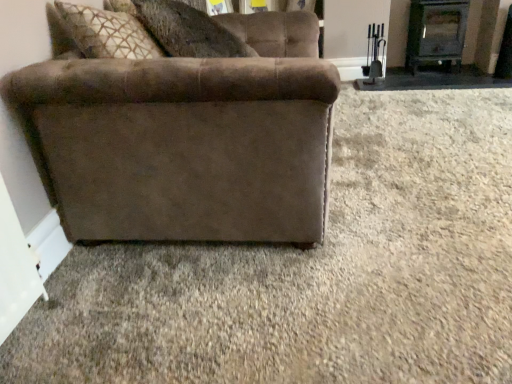
Measure the distance between point (143, 102) and camera.

Point (143, 102) and camera are 1.33 meters apart.

What do you see at coordinates (186, 139) in the screenshot? I see `suede brown couch at left` at bounding box center [186, 139].

You are a GUI agent. You are given a task and a screenshot of the screen. Output one action in this format:
    pyautogui.click(x=<x>, y=<y>)
    Task: Click on the suede-like brown pillow at upper center
    
    Given the screenshot: What is the action you would take?
    pyautogui.click(x=188, y=31)

Considering the relative sizes of black metal fireplace at upper right and suede-like brown pillow at upper center in the image provided, is black metal fireplace at upper right smaller than suede-like brown pillow at upper center?

Indeed, black metal fireplace at upper right has a smaller size compared to suede-like brown pillow at upper center.

From a real-world perspective, is black metal fireplace at upper right on top of suede-like brown pillow at upper center?

No, from a real-world perspective, black metal fireplace at upper right is not above suede-like brown pillow at upper center.

The image size is (512, 384). In the image, there is a suede-like brown pillow at upper center. Find the location of `fireplace below it (from a real-world perspective)`. fireplace below it (from a real-world perspective) is located at coordinates (436, 33).

Looking at their sizes, would you say black metal fireplace at upper right is wider or thinner than suede-like brown pillow at upper center?

In the image, black metal fireplace at upper right appears to be more narrow than suede-like brown pillow at upper center.

Is black metal fireplace at upper right smaller than suede brown couch at left?

Indeed, black metal fireplace at upper right has a smaller size compared to suede brown couch at left.

From the image's perspective, does black metal fireplace at upper right appear higher than suede brown couch at left?

Correct, black metal fireplace at upper right appears higher than suede brown couch at left in the image.

Which of these two, black metal fireplace at upper right or suede brown couch at left, stands shorter?

Standing shorter between the two is black metal fireplace at upper right.

Considering the relative positions of black metal fireplace at upper right and suede brown couch at left in the image provided, is black metal fireplace at upper right behind suede brown couch at left?

Yes.

Which of these two, suede-like brown pillow at upper center or black metal fireplace at upper right, stands taller?

With more height is black metal fireplace at upper right.

How many degrees apart are the facing directions of suede-like brown pillow at upper center and black metal fireplace at upper right?

The facing directions of suede-like brown pillow at upper center and black metal fireplace at upper right are 99.3 degrees apart.

Who is bigger, suede-like brown pillow at upper center or black metal fireplace at upper right?

suede-like brown pillow at upper center is bigger.

Considering the relative sizes of suede-like brown pillow at upper center and black metal fireplace at upper right in the image provided, is suede-like brown pillow at upper center wider than black metal fireplace at upper right?

Indeed, suede-like brown pillow at upper center has a greater width compared to black metal fireplace at upper right.

From a real-world perspective, between suede brown couch at left and black metal fireplace at upper right, who is vertically lower?

black metal fireplace at upper right.

Looking at their sizes, would you say suede brown couch at left is wider or thinner than black metal fireplace at upper right?

Clearly, suede brown couch at left has more width compared to black metal fireplace at upper right.

From the image's perspective, is suede brown couch at left under black metal fireplace at upper right?

Correct, suede brown couch at left appears lower than black metal fireplace at upper right in the image.

Which is correct: suede brown couch at left is inside black metal fireplace at upper right, or outside of it?

suede brown couch at left exists outside the volume of black metal fireplace at upper right.

Based on the photo, is suede-like brown pillow at upper center wider than suede brown couch at left?

In fact, suede-like brown pillow at upper center might be narrower than suede brown couch at left.

Is suede-like brown pillow at upper center behind suede brown couch at left?

Yes, suede-like brown pillow at upper center is further from the viewer.

Considering the relative sizes of suede-like brown pillow at upper center and suede brown couch at left in the image provided, is suede-like brown pillow at upper center taller than suede brown couch at left?

Incorrect, the height of suede-like brown pillow at upper center is not larger of that of suede brown couch at left.

Is there a large distance between suede-like brown pillow at upper center and suede brown couch at left?

Actually, suede-like brown pillow at upper center and suede brown couch at left are a little close together.

From a real-world perspective, is suede brown couch at left positioned above or below suede-like brown pillow at upper center?

Clearly, from a real-world perspective, suede brown couch at left is below suede-like brown pillow at upper center.

From the image's perspective, which is above, suede brown couch at left or suede-like brown pillow at upper center?

suede-like brown pillow at upper center, from the image's perspective.

Identify the location of studio couch below the suede-like brown pillow at upper center (from the image's perspective). The height and width of the screenshot is (384, 512). (186, 139).

Who is smaller, suede brown couch at left or suede-like brown pillow at upper center?

suede-like brown pillow at upper center is smaller.

The image size is (512, 384). Find the location of `fireplace on the right side of suede-like brown pillow at upper center`. fireplace on the right side of suede-like brown pillow at upper center is located at coordinates (436, 33).

In the image, there is a suede brown couch at left. Identify the location of fireplace above it (from the image's perspective). The width and height of the screenshot is (512, 384). (436, 33).

From the image, which object appears to be farther from suede-like brown pillow at upper center, suede brown couch at left or black metal fireplace at upper right?

black metal fireplace at upper right lies further to suede-like brown pillow at upper center than the other object.

Considering their positions, is black metal fireplace at upper right positioned further to suede-like brown pillow at upper center than suede brown couch at left?

The object further to suede-like brown pillow at upper center is black metal fireplace at upper right.

Based on their spatial positions, is suede-like brown pillow at upper center or suede brown couch at left further from black metal fireplace at upper right?

suede brown couch at left.

From the picture: Looking at the image, which one is located further to black metal fireplace at upper right, suede brown couch at left or suede-like brown pillow at upper center?

suede brown couch at left is further to black metal fireplace at upper right.

Based on the photo, estimate the real-world distances between objects in this image. Which object is closer to suede brown couch at left, black metal fireplace at upper right or suede-like brown pillow at upper center?

suede-like brown pillow at upper center is positioned closer to the anchor suede brown couch at left.

Looking at the image, which one is located further to suede brown couch at left, suede-like brown pillow at upper center or black metal fireplace at upper right?

Among the two, black metal fireplace at upper right is located further to suede brown couch at left.

Locate an element on the screen. Image resolution: width=512 pixels, height=384 pixels. pillow located between suede brown couch at left and black metal fireplace at upper right in the depth direction is located at coordinates (188, 31).